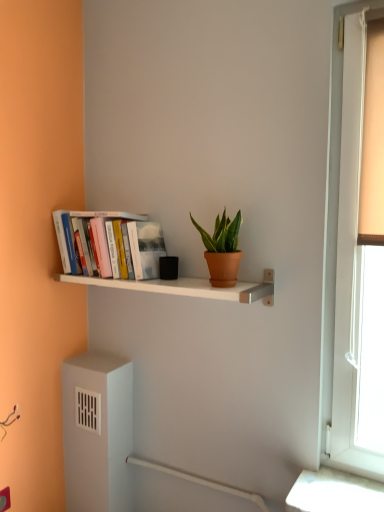
Find the location of a particular element. blank area to the left of terracotta clay pot at center is located at coordinates (175, 283).